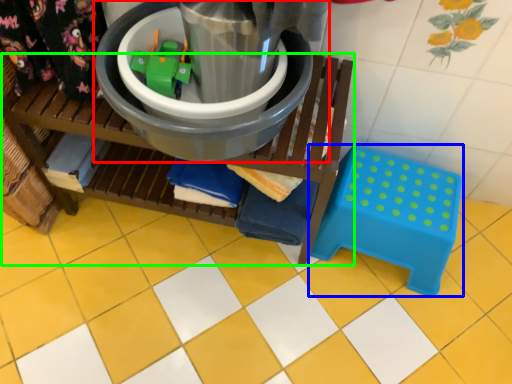
Question: Which object is the closest to the appliance (highlighted by a red box)? Choose among these: step stool (highlighted by a blue box) or furniture (highlighted by a green box).

Choices:
 (A) step stool
 (B) furniture

Answer: (B)